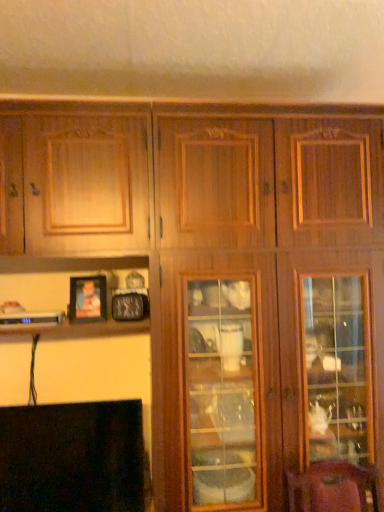
In order to face black glossy fireplace at lower left, should I rotate leftwards or rightwards?

To align with it, rotate left about 15.975°.

The image size is (384, 512). Describe the element at coordinates (72, 457) in the screenshot. I see `black glossy fireplace at lower left` at that location.

Locate an element on the screen. black glossy fireplace at lower left is located at coordinates (72, 457).

What do you see at coordinates (87, 298) in the screenshot?
I see `wooden photo frame at lower left` at bounding box center [87, 298].

Locate an element on the screen. wooden photo frame at lower left is located at coordinates (87, 298).

At what (x,y) coordinates should I click in order to perform the action: click on black glossy fireplace at lower left. Please return your answer as a coordinate pair (x, y). Looking at the image, I should click on click(x=72, y=457).

Based on the photo, which is more to the left, black glossy fireplace at lower left or wooden photo frame at lower left?

From the viewer's perspective, black glossy fireplace at lower left appears more on the left side.

Between black glossy fireplace at lower left and wooden photo frame at lower left, which one is positioned behind?

wooden photo frame at lower left is more distant.

Is point (36, 406) positioned in front of point (80, 288)?

That is True.

From the image's perspective, which one is positioned higher, black glossy fireplace at lower left or wooden photo frame at lower left?

wooden photo frame at lower left.

From a real-world perspective, is black glossy fireplace at lower left above or below wooden photo frame at lower left?

In terms of real-world spatial position, black glossy fireplace at lower left is below wooden photo frame at lower left.

Which of these two, black glossy fireplace at lower left or wooden photo frame at lower left, is thinner?

With smaller width is wooden photo frame at lower left.

Considering the sizes of objects black glossy fireplace at lower left and wooden photo frame at lower left in the image provided, who is taller, black glossy fireplace at lower left or wooden photo frame at lower left?

Standing taller between the two is black glossy fireplace at lower left.

From the picture: Considering the sizes of objects black glossy fireplace at lower left and wooden photo frame at lower left in the image provided, who is bigger, black glossy fireplace at lower left or wooden photo frame at lower left?

black glossy fireplace at lower left is bigger.

Is black glossy fireplace at lower left located outside wooden photo frame at lower left?

Absolutely, black glossy fireplace at lower left is external to wooden photo frame at lower left.

From the picture: Is black glossy fireplace at lower left beside wooden photo frame at lower left?

No, black glossy fireplace at lower left is not touching wooden photo frame at lower left.

Could you tell me if black glossy fireplace at lower left is facing wooden photo frame at lower left?

No, black glossy fireplace at lower left is not turned towards wooden photo frame at lower left.

Measure the distance between black glossy fireplace at lower left and wooden photo frame at lower left.

The distance of black glossy fireplace at lower left from wooden photo frame at lower left is 18.99 inches.

Locate an element on the screen. The image size is (384, 512). fireplace in front of the wooden photo frame at lower left is located at coordinates (72, 457).

Based on the photo, is wooden photo frame at lower left at the left side of black glossy fireplace at lower left?

In fact, wooden photo frame at lower left is to the right of black glossy fireplace at lower left.

Who is more distant, wooden photo frame at lower left or black glossy fireplace at lower left?

wooden photo frame at lower left is further from the camera.

Which is further, (104,298) or (125,477)?

The point (104,298) is farther from the camera.

From the image's perspective, does wooden photo frame at lower left appear higher than black glossy fireplace at lower left?

Yes, from the image's perspective, wooden photo frame at lower left is above black glossy fireplace at lower left.

From a real-world perspective, relative to black glossy fireplace at lower left, is wooden photo frame at lower left vertically above or below?

Clearly, from a real-world perspective, wooden photo frame at lower left is above black glossy fireplace at lower left.

Is wooden photo frame at lower left wider than black glossy fireplace at lower left?

No.

Who is shorter, wooden photo frame at lower left or black glossy fireplace at lower left?

→ wooden photo frame at lower left.

Is wooden photo frame at lower left bigger or smaller than black glossy fireplace at lower left?

wooden photo frame at lower left is smaller than black glossy fireplace at lower left.

Looking at this image, can we say wooden photo frame at lower left lies outside black glossy fireplace at lower left?

Yes, wooden photo frame at lower left is not within black glossy fireplace at lower left.

Is wooden photo frame at lower left far from black glossy fireplace at lower left?

No.

Is wooden photo frame at lower left turned away from black glossy fireplace at lower left?

That's not correct — wooden photo frame at lower left is not looking away from black glossy fireplace at lower left.

What's the angular difference between wooden photo frame at lower left and black glossy fireplace at lower left's facing directions?

There is a 1.16-degree angle between the facing directions of wooden photo frame at lower left and black glossy fireplace at lower left.

Find the location of a particular element. The image size is (384, 512). picture frame lying above the black glossy fireplace at lower left (from the image's perspective) is located at coordinates (87, 298).

Where is `picture frame that appears behind the black glossy fireplace at lower left`? The image size is (384, 512). picture frame that appears behind the black glossy fireplace at lower left is located at coordinates (87, 298).

This screenshot has height=512, width=384. In order to click on fireplace to the left of wooden photo frame at lower left in this screenshot , I will do point(72,457).